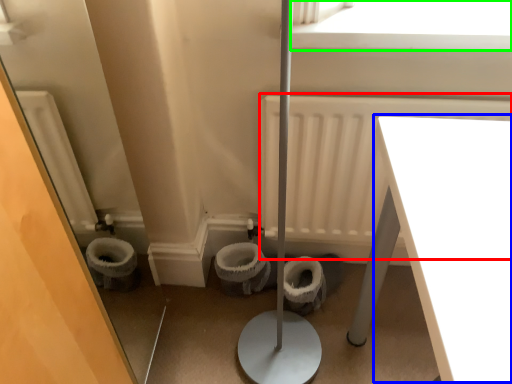
Question: Estimate the real-world distances between objects in this image. Which object is farther from radiator (highlighted by a red box), table (highlighted by a blue box) or window screen (highlighted by a green box)?

Choices:
 (A) table
 (B) window screen

Answer: (A)